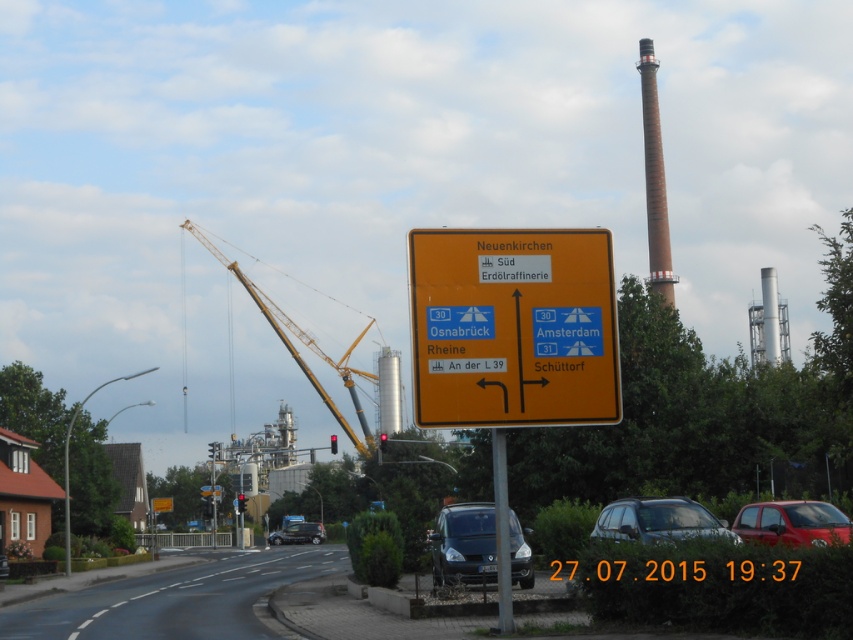
Question: Which object is the closest to the yellow plastic sign at center?

Choices:
 (A) shiny red car at center
 (B) metallic pole at center
 (C) yellow metallic crane at left
 (D) matte black car at center

Answer: (B)

Question: Can you confirm if satin silver car at center is bigger than matte black car at center?

Choices:
 (A) no
 (B) yes

Answer: (A)

Question: Which object appears farthest from the camera in this image?

Choices:
 (A) yellow metallic crane at left
 (B) matte black car at center
 (C) yellow plastic sign at center

Answer: (A)

Question: Can you confirm if yellow plastic sign at center is positioned to the right of metallic pole at center?

Choices:
 (A) no
 (B) yes

Answer: (A)

Question: From the image, what is the correct spatial relationship of matte black van at center in relation to satin silver car at center?

Choices:
 (A) right
 (B) left

Answer: (B)

Question: Considering the real-world distances, which object is closest to the matte black van at center?

Choices:
 (A) shiny red car at center
 (B) yellow metallic crane at left
 (C) metallic pole at center

Answer: (A)